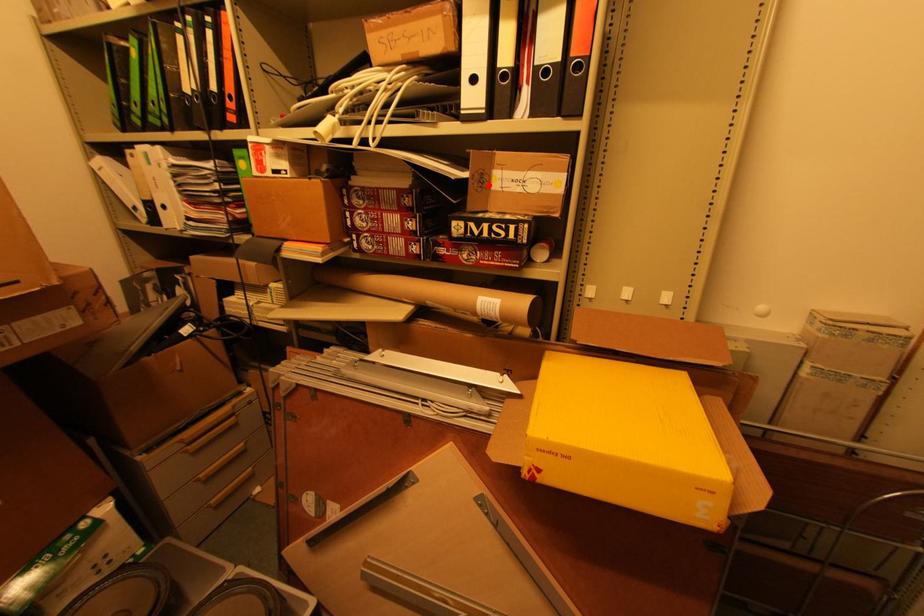
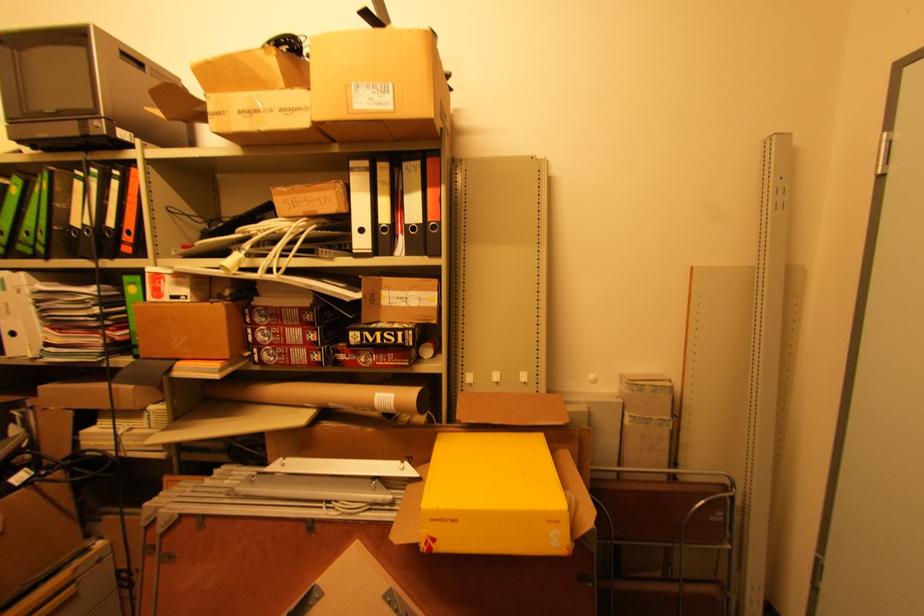
The point at the highlighted location is marked in the first image. Where is the corresponding point in the second image?

(380, 302)